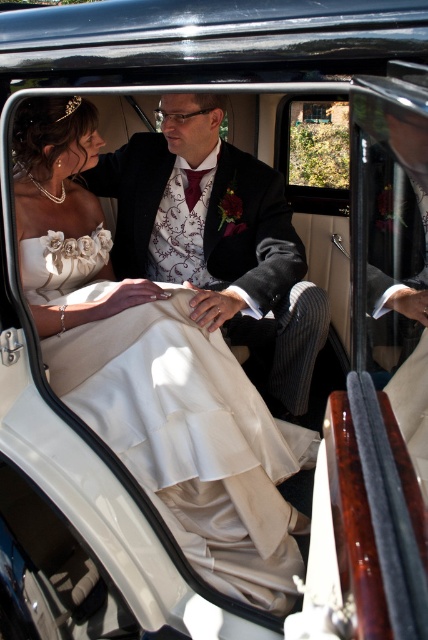
Question: Does satin/crepe wedding dress at center have a larger size compared to white satin dress at center?

Choices:
 (A) no
 (B) yes

Answer: (A)

Question: Does satin/crepe wedding dress at center have a greater width compared to white satin dress at center?

Choices:
 (A) yes
 (B) no

Answer: (A)

Question: Can you confirm if satin/crepe wedding dress at center is positioned to the left of white satin dress at center?

Choices:
 (A) yes
 (B) no

Answer: (A)

Question: Which of the following is the farthest from the observer?

Choices:
 (A) satin/crepe wedding dress at center
 (B) white satin dress at center

Answer: (B)

Question: Which point is closer to the camera?

Choices:
 (A) (202, 384)
 (B) (234, 310)

Answer: (A)

Question: Which of the following is the closest to the observer?

Choices:
 (A) (279, 561)
 (B) (124, 237)

Answer: (A)